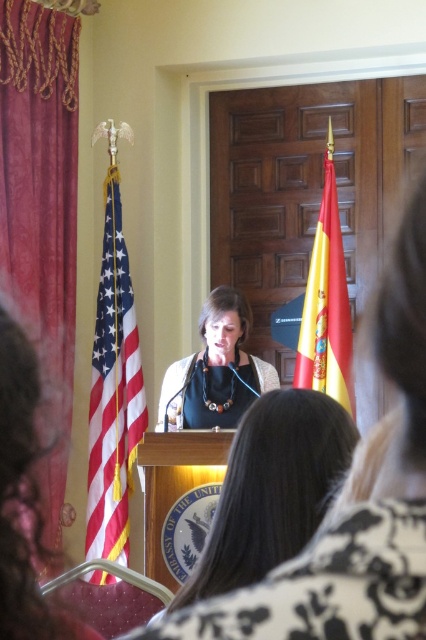
Is american flag at left thinner than yellow/red fabric flag at right?

Incorrect, american flag at left's width is not less than yellow/red fabric flag at right's.

Is american flag at left wider than yellow/red fabric flag at right?

Yes.

Identify the location of american flag at left. (114, 392).

Is point (98, 417) behind point (207, 362)?

Yes.

The image size is (426, 640). Identify the location of american flag at left. (114, 392).

Is point (109, 228) positioned in front of point (207, 321)?

No.

This screenshot has height=640, width=426. I want to click on american flag at left, so click(114, 392).

Which is more to the right, matte black podium at center or yellow/red fabric flag at right?

Positioned to the right is yellow/red fabric flag at right.

Between matte black podium at center and yellow/red fabric flag at right, which one appears on the left side from the viewer's perspective?

matte black podium at center

Which is behind, point (293, 408) or point (325, 266)?

Point (325, 266)

Image resolution: width=426 pixels, height=640 pixels. What are the coordinates of `matte black podium at center` in the screenshot? It's located at (271, 490).